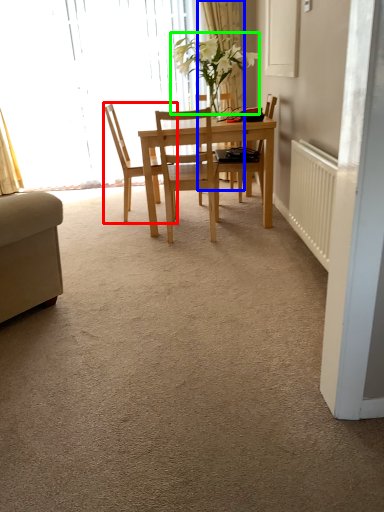
Question: Estimate the real-world distances between objects in this image. Which object is farther from chair (highlighted by a red box), curtain (highlighted by a blue box) or plant (highlighted by a green box)?

Choices:
 (A) curtain
 (B) plant

Answer: (A)